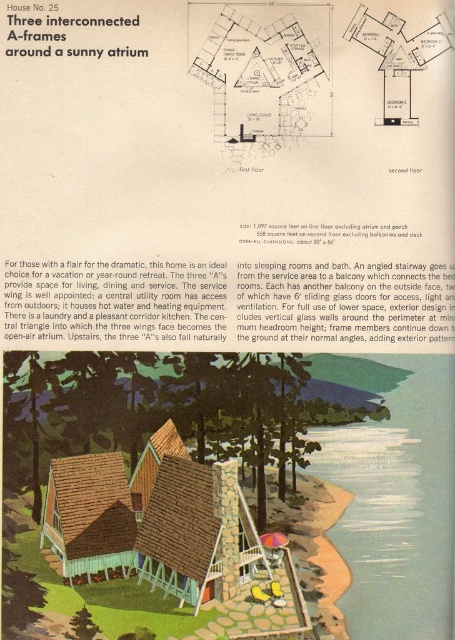
Question: Which object is closer to the camera taking this photo?

Choices:
 (A) brown shingles at lower left
 (B) brown shingles at center

Answer: (A)

Question: Among these objects, which one is nearest to the camera?

Choices:
 (A) brown shingles at lower left
 (B) brown shingles at center

Answer: (A)

Question: Does brown shingles at center appear over brown shingles at lower left?

Choices:
 (A) yes
 (B) no

Answer: (A)

Question: Does brown shingles at center have a smaller size compared to brown shingles at lower left?

Choices:
 (A) yes
 (B) no

Answer: (B)

Question: Can you confirm if brown shingles at center is positioned to the left of brown shingles at lower left?

Choices:
 (A) no
 (B) yes

Answer: (A)